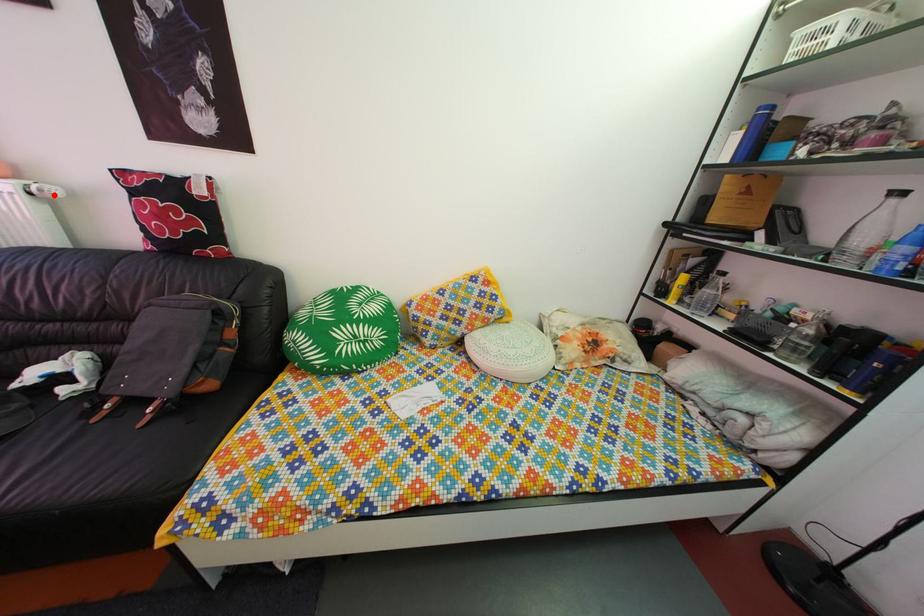
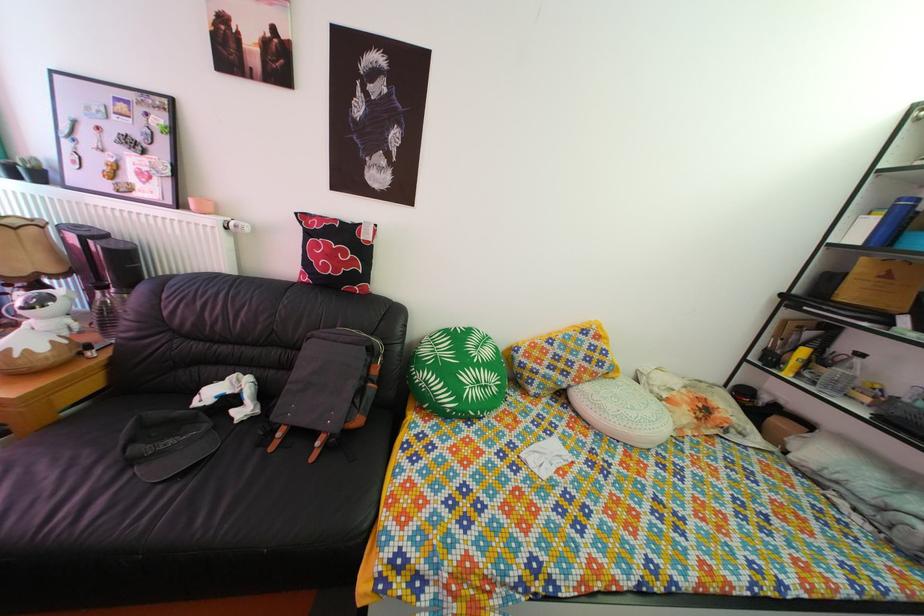
Question: A red point is marked in image1. In image2, is the corresponding 3D point closer to the camera or farther? Reply with the corresponding letter.

Choices:
 (A) The corresponding 3D point is closer.
 (B) The corresponding 3D point is farther.

Answer: (A)